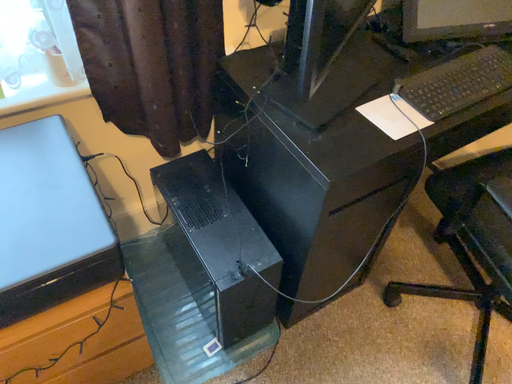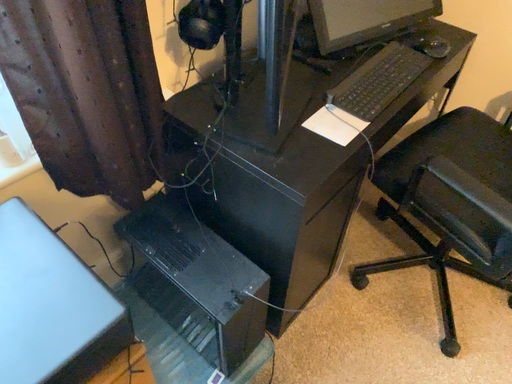
Question: Which way did the camera rotate in the video?

Choices:
 (A) rotated right
 (B) rotated left

Answer: (A)